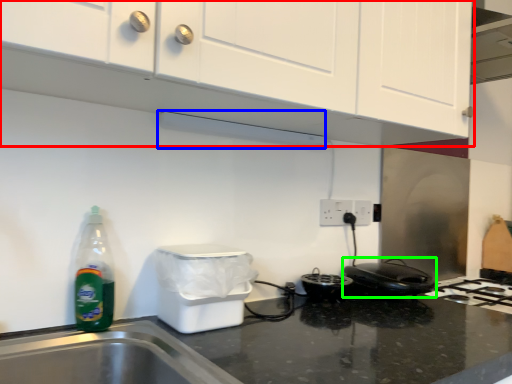
Question: Considering the real-world distances, which object is closest to cabinetry (highlighted by a red box)? exhaust hood (highlighted by a blue box) or home appliance (highlighted by a green box).

Choices:
 (A) exhaust hood
 (B) home appliance

Answer: (A)